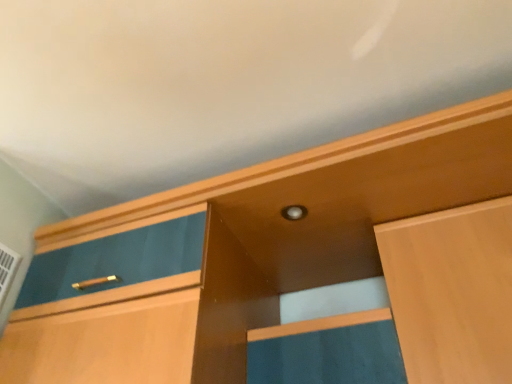
This screenshot has height=384, width=512. Identify the location of light wood cabinet at upper right. coord(452,292).

What do you see at coordinates (452, 292) in the screenshot?
I see `light wood cabinet at upper right` at bounding box center [452, 292].

Measure the distance between point (404, 254) and camera.

They are 1.16 meters apart.

The width and height of the screenshot is (512, 384). Identify the location of light wood cabinet at upper right. 452,292.